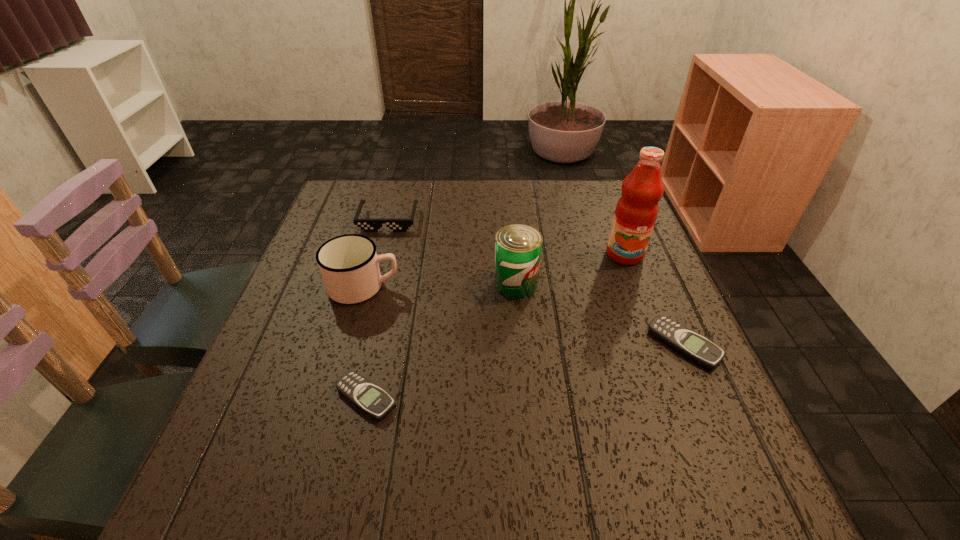
Please determine a free point for an extra beeper to ensure balance. Please provide its 2D coordinates. Your answer should be formatted as a tuple, i.e. [(x, y)], where the tuple contains the x and y coordinates of a point satisfying the conditions above.

[(534, 370)]